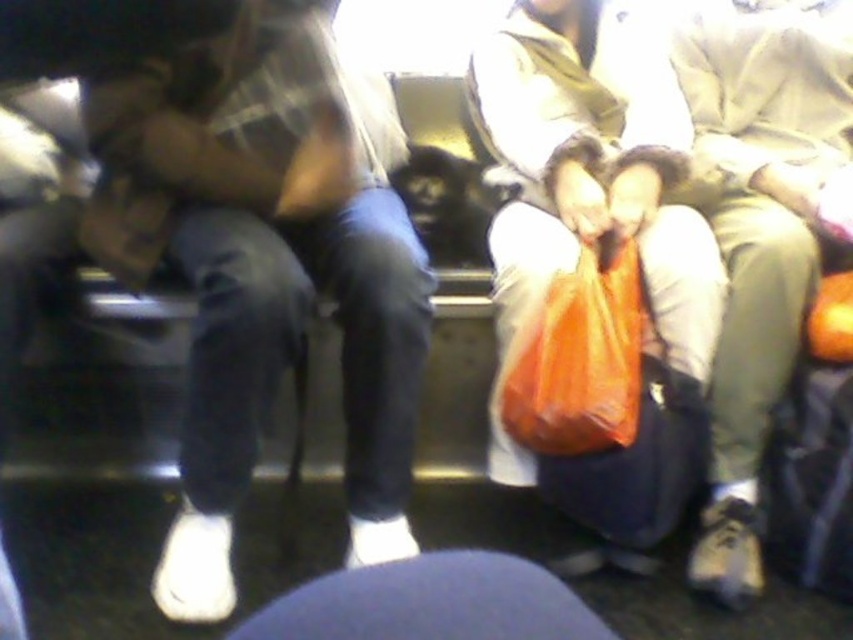
You are a passenger in a moving train car and notice two items ahead of you. One is denim pants at left and the other is orange fabric bag at center. Which item takes up more space in the scene?

The denim pants at left takes up more space in the scene since it has a larger size compared to the orange fabric bag at center.

You are a delivery robot in a train car. You need to move a package from the orange plastic bag at center to the matte black suitcase at lower right. Can you fit the package in the space between them?

→ The orange plastic bag at center and matte black suitcase at lower right are 36.27 centimeters apart from each other. If the package is smaller than or equal to 36.27 centimeters in width, it can fit in the space between them.